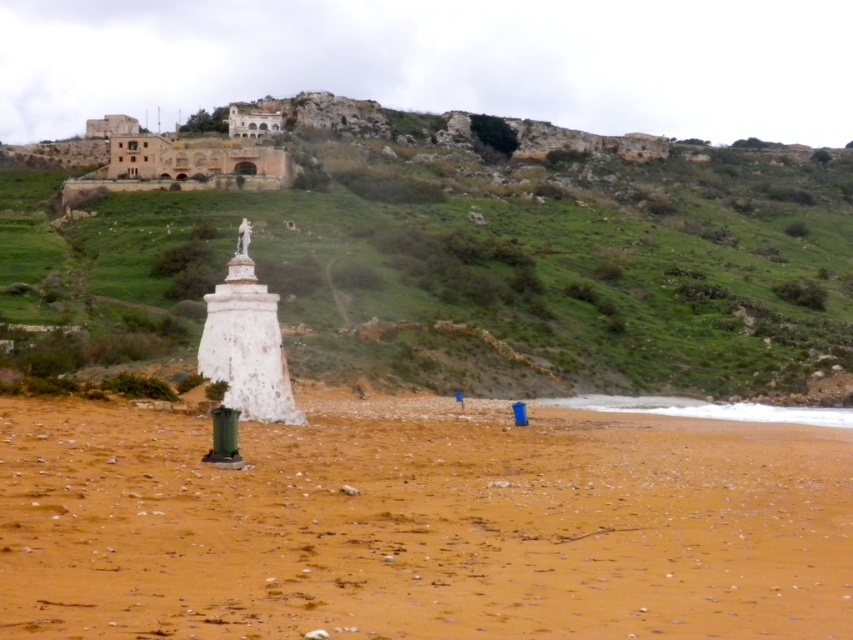
Does green grassy hillside at upper center have a greater width compared to brown sandy beach at lower center?

Yes.

Is point (624, 145) farther from viewer compared to point (345, 589)?

Yes, it is behind point (345, 589).

Locate an element on the screen. green grassy hillside at upper center is located at coordinates (457, 252).